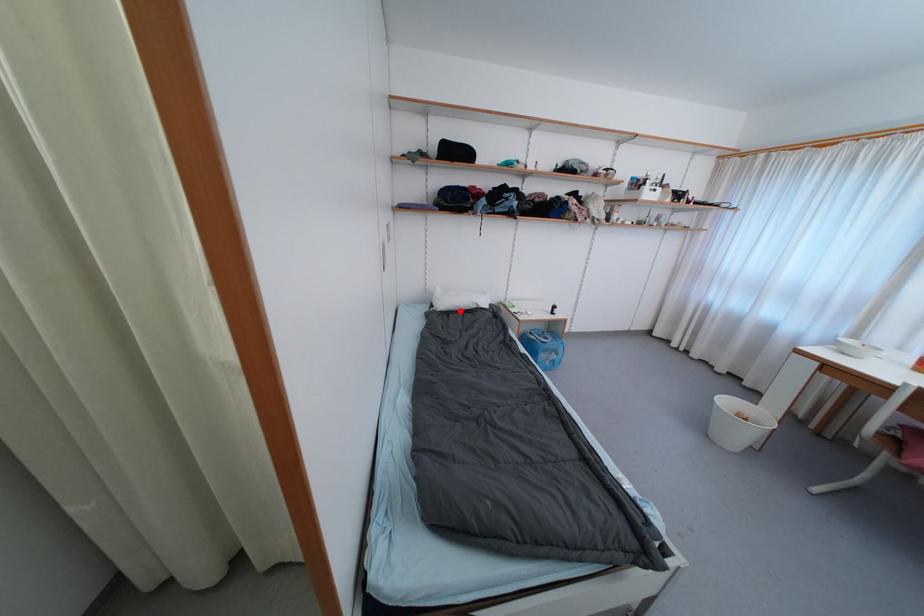
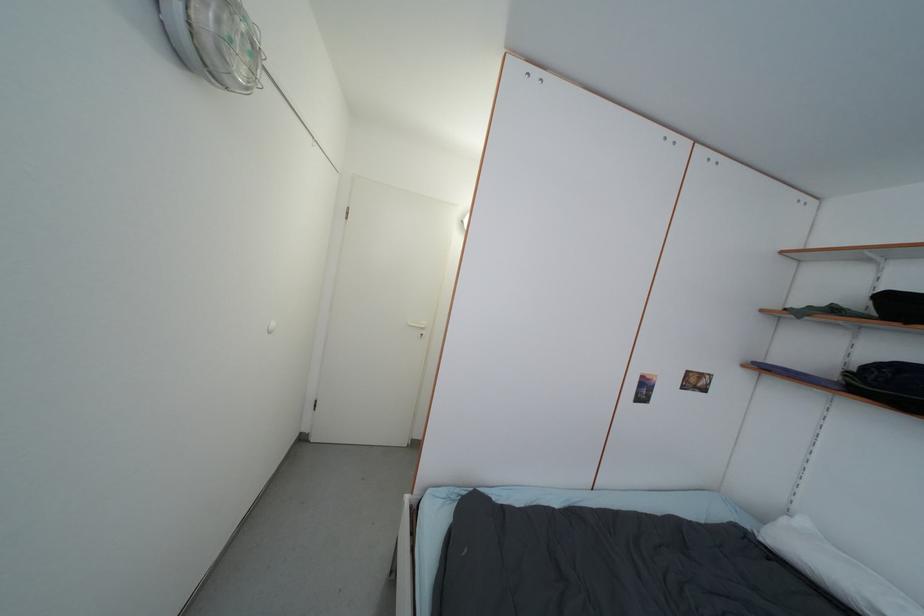
Where in the second image is the point corresponding to the highlighted location from the first image?

(812, 576)